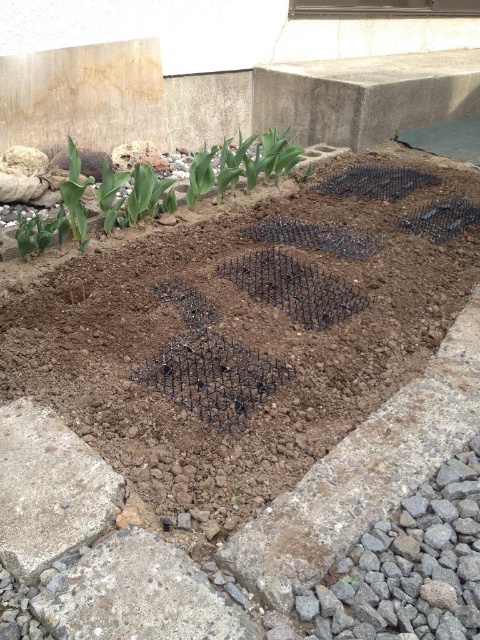
Question: Can you confirm if green leafy plant at upper left is positioned to the left of green leafy plant at left?

Choices:
 (A) yes
 (B) no

Answer: (B)

Question: Can you confirm if green leafy plant at upper left is bigger than green leafy plant at left?

Choices:
 (A) no
 (B) yes

Answer: (B)

Question: Observing the image, what is the correct spatial positioning of green leafy plant at upper left in reference to green leafy plant at left?

Choices:
 (A) above
 (B) below

Answer: (A)

Question: Which of the following is the farthest from the observer?

Choices:
 (A) green leafy plant at upper left
 (B) green leafy plant at left

Answer: (A)

Question: Which of the following is the closest to the observer?

Choices:
 (A) green leafy plant at upper left
 (B) green leafy plant at left

Answer: (B)

Question: Among these points, which one is farthest from the camera?

Choices:
 (A) (80, 164)
 (B) (184, 196)

Answer: (B)